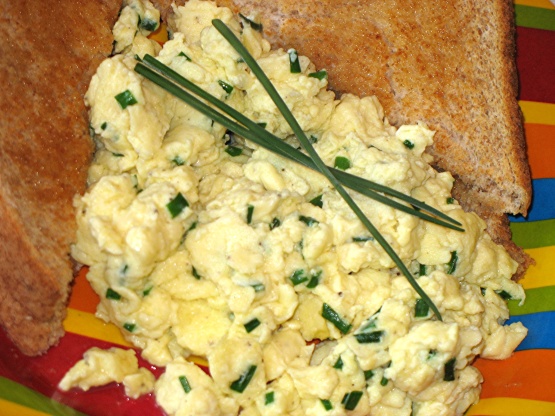
Where is `1 plate`? 1 plate is located at coordinates (58, 357).